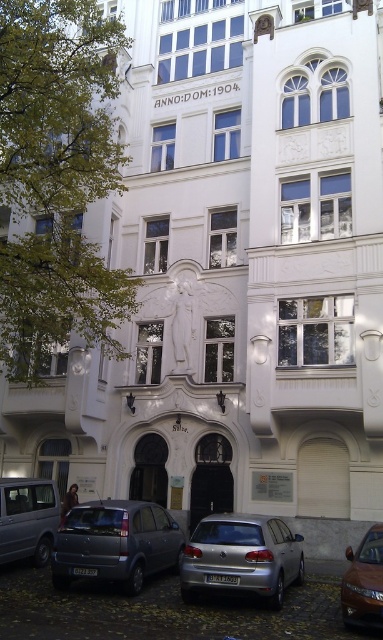
You are a delivery person arriving at the building and need to park your vehicle. The parking spot is located to the right of the entrance. Which vehicle should you park behind, the silver metallic van at lower left or the brown metallic car at lower right?

The silver metallic van at lower left is to the left of brown metallic car at lower right. Since the parking spot is to the right of the entrance, you should park behind the brown metallic car at lower right, which is positioned to the right side of the silver van.

You are standing in front of the building and want to touch both the statue above the entrance and the top of the arched doorway. The statue is located at point (250,532) and the top of the arched doorway is at point (373,605). Which point do you need to reach first as you move towards the building?

You need to reach point (250,532) first because it is closer to you than point (373,605), which is further away.

You are standing in front of the building and notice two points marked on the facade. The first point is at coordinates point (39, 520) and the second is at point (381, 564). Which point is closer to you?

Point (39, 520) is further to the camera than point (381, 564). Therefore, the point closer to you is point (381, 564).